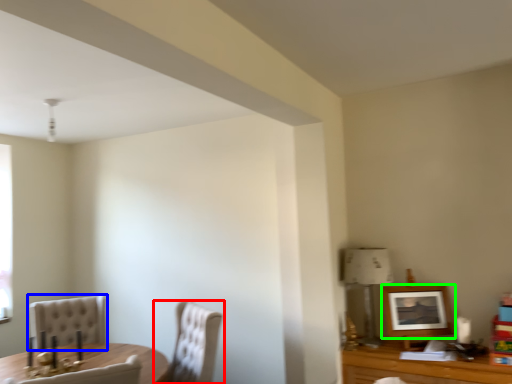
Question: Which object is positioned farthest from chair (highlighted by a red box)? Select from chair (highlighted by a blue box) and picture frame (highlighted by a green box).

Choices:
 (A) chair
 (B) picture frame

Answer: (B)